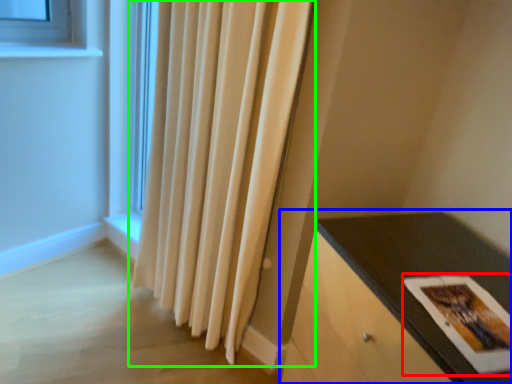
Question: Based on their relative distances, which object is nearer to postcard (highlighted by a red box)? Choose from table (highlighted by a blue box) and curtain (highlighted by a green box).

Choices:
 (A) table
 (B) curtain

Answer: (A)